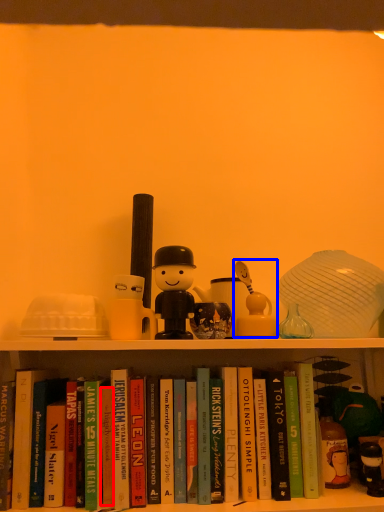
Question: Among these objects, which one is nearest to the camera, paperback book (highlighted by a red box) or figurine (highlighted by a blue box)?

Choices:
 (A) paperback book
 (B) figurine

Answer: (A)